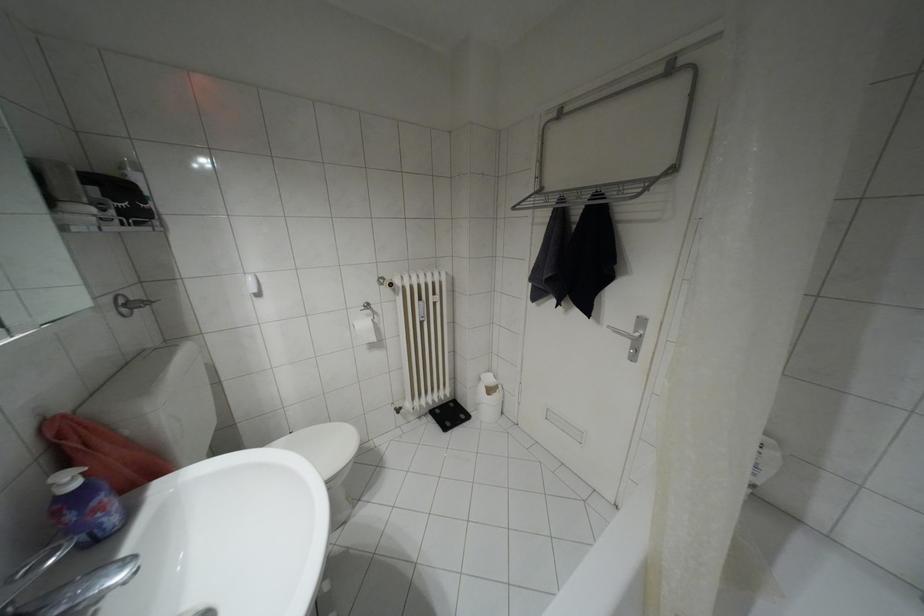
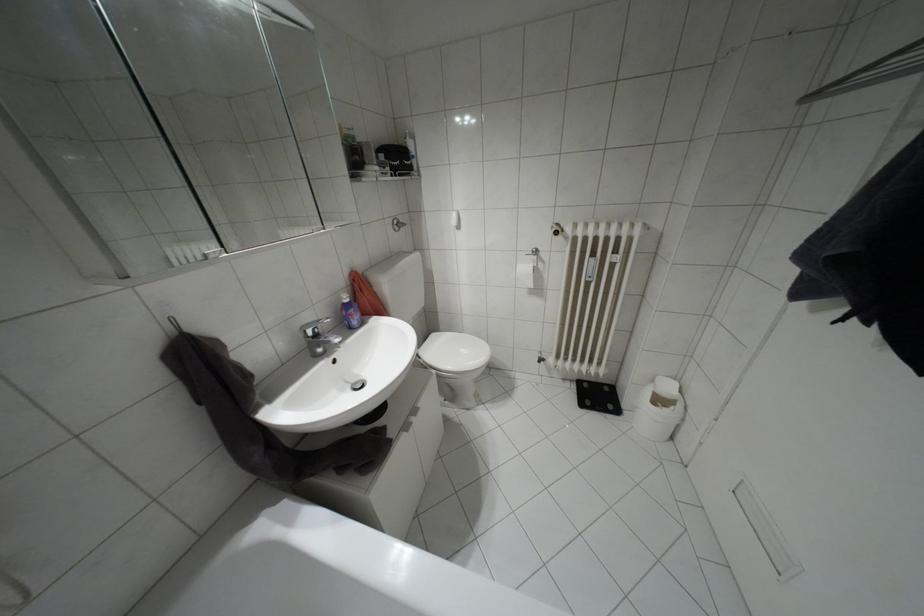
Locate, in the second image, the point that corresponds to (x=479, y=379) in the first image.

(652, 379)